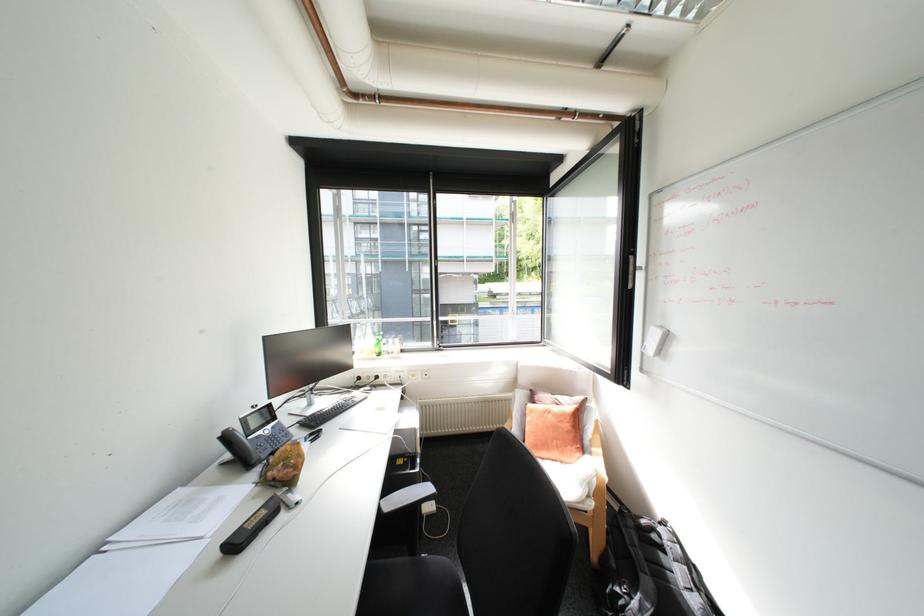
The image size is (924, 616). In order to click on white radiator valve in this screenshot , I will do `click(463, 414)`.